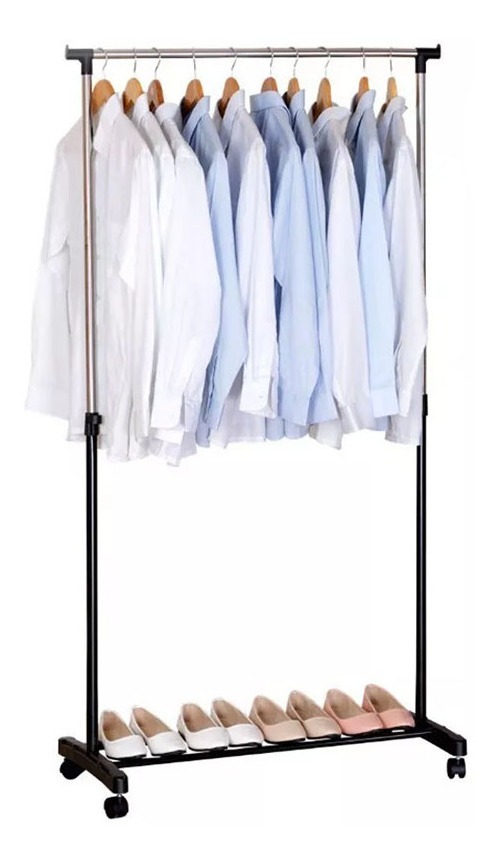
At what (x,y) coordinates should I click in order to perform the action: click on clothes hangers. Please return your answer as a coordinate pair (x, y). Image resolution: width=499 pixels, height=865 pixels. Looking at the image, I should click on (103, 86), (132, 82), (157, 82), (195, 86), (232, 86), (268, 84), (293, 85), (325, 87), (362, 88), (390, 80).